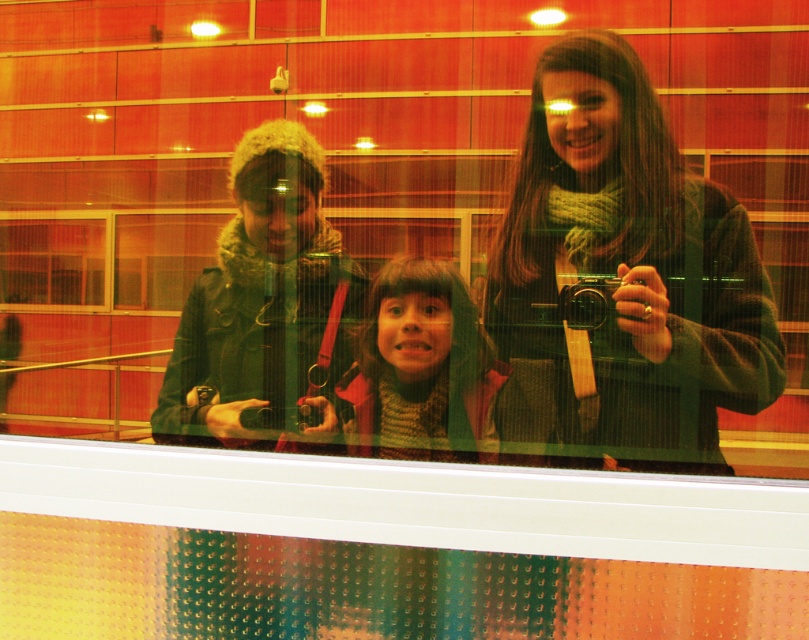
Describe the element at coordinates (359, 147) in the screenshot. I see `transparent glass at center` at that location.

Who is positioned more to the right, transparent glass at center or green knitted sweater at center?

green knitted sweater at center is more to the right.

Which is in front, point (318, 84) or point (363, 444)?

Point (363, 444)

Locate an element on the screen. The width and height of the screenshot is (809, 640). transparent glass at center is located at coordinates (359, 147).

Between point (661, 259) and point (257, 129), which one is positioned behind?

Point (257, 129)

The height and width of the screenshot is (640, 809). Describe the element at coordinates (623, 278) in the screenshot. I see `green fuzzy scarf at upper center` at that location.

Is point (574, 332) closer to camera compared to point (282, 150)?

Yes, it is in front of point (282, 150).

Find the location of a particular element. This screenshot has height=640, width=809. green fuzzy scarf at upper center is located at coordinates (623, 278).

Does transparent glass at center have a lesser height compared to matte black camera at center?

No.

Does transparent glass at center lie in front of matte black camera at center?

Yes.

Find the location of a particular element. Image resolution: width=809 pixels, height=640 pixels. transparent glass at center is located at coordinates (359, 147).